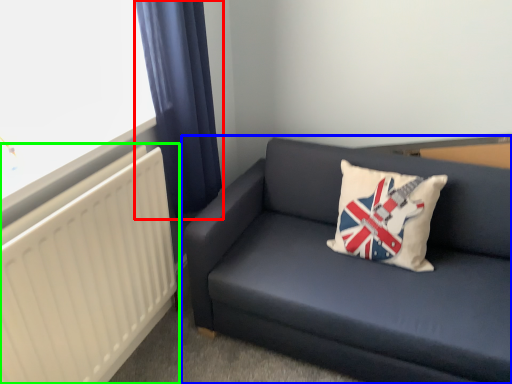
Question: Estimate the real-world distances between objects in this image. Which object is closer to curtain (highlighted by a red box), studio couch (highlighted by a blue box) or radiator (highlighted by a green box)?

Choices:
 (A) studio couch
 (B) radiator

Answer: (B)